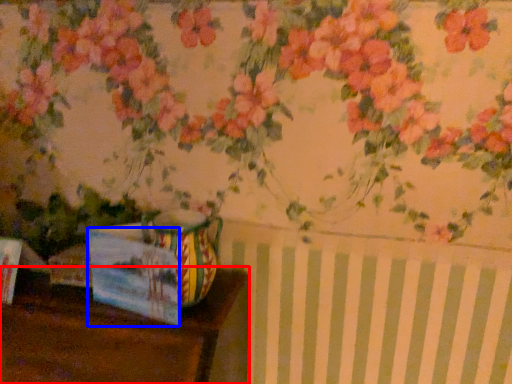
Question: Among these objects, which one is nearest to the camera, table (highlighted by a red box) or postcard (highlighted by a blue box)?

Choices:
 (A) table
 (B) postcard

Answer: (A)